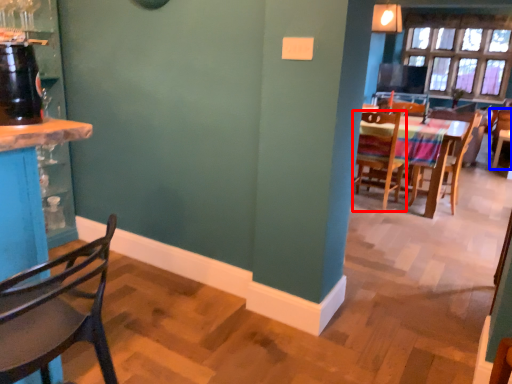
Question: Among these objects, which one is farthest to the camera, chair (highlighted by a red box) or chair (highlighted by a blue box)?

Choices:
 (A) chair
 (B) chair

Answer: (B)